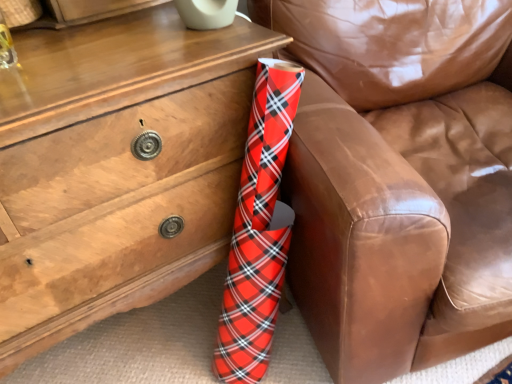
Question: Is red plaid wrapping paper at lower left facing towards matte wood chest of drawers at lower left?

Choices:
 (A) yes
 (B) no

Answer: (B)

Question: From a real-world perspective, is red plaid wrapping paper at lower left beneath matte wood chest of drawers at lower left?

Choices:
 (A) yes
 (B) no

Answer: (B)

Question: Does red plaid wrapping paper at lower left have a lesser width compared to matte wood chest of drawers at lower left?

Choices:
 (A) no
 (B) yes

Answer: (A)

Question: Is red plaid wrapping paper at lower left not within matte wood chest of drawers at lower left?

Choices:
 (A) no
 (B) yes

Answer: (B)

Question: From the image's perspective, is red plaid wrapping paper at lower left on top of matte wood chest of drawers at lower left?

Choices:
 (A) no
 (B) yes

Answer: (B)

Question: Does red plaid wrapping paper at lower left have a larger size compared to matte wood chest of drawers at lower left?

Choices:
 (A) no
 (B) yes

Answer: (B)

Question: Is matte wood chest of drawers at lower left positioned with its back to red plaid wrapping paper at lower left?

Choices:
 (A) no
 (B) yes

Answer: (A)

Question: Does matte wood chest of drawers at lower left appear on the right side of red plaid wrapping paper at lower left?

Choices:
 (A) no
 (B) yes

Answer: (A)

Question: From a real-world perspective, is matte wood chest of drawers at lower left positioned over red plaid wrapping paper at lower left based on gravity?

Choices:
 (A) yes
 (B) no

Answer: (B)

Question: Is matte wood chest of drawers at lower left placed right next to red plaid wrapping paper at lower left?

Choices:
 (A) yes
 (B) no

Answer: (B)

Question: From a real-world perspective, is matte wood chest of drawers at lower left beneath red plaid wrapping paper at lower left?

Choices:
 (A) yes
 (B) no

Answer: (A)

Question: Is matte wood chest of drawers at lower left outside of red plaid wrapping paper at lower left?

Choices:
 (A) yes
 (B) no

Answer: (A)

Question: In the image, is matte wood chest of drawers at lower left positioned in front of or behind red plaid wrapping paper at lower left?

Choices:
 (A) behind
 (B) front

Answer: (A)